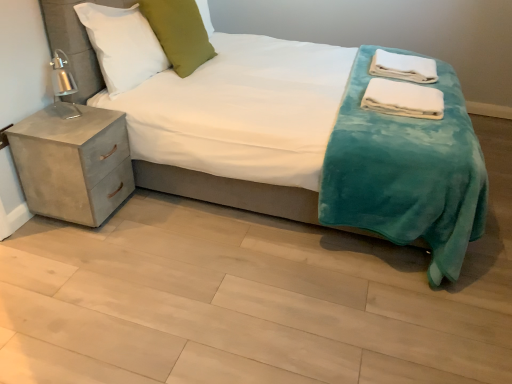
Question: Can you confirm if green velvet pillow at upper center, which appears as the second pillow when viewed from the left, is smaller than concrete nightstand at left?

Choices:
 (A) no
 (B) yes

Answer: (B)

Question: Would you say green velvet pillow at upper center, the first pillow when ordered from right to left, is outside concrete nightstand at left?

Choices:
 (A) yes
 (B) no

Answer: (A)

Question: Is green velvet pillow at upper center, which appears as the second pillow when viewed from the left, in front of concrete nightstand at left?

Choices:
 (A) yes
 (B) no

Answer: (B)

Question: Is green velvet pillow at upper center, the first pillow when ordered from right to left, further to camera compared to concrete nightstand at left?

Choices:
 (A) yes
 (B) no

Answer: (A)

Question: Is green velvet pillow at upper center, which appears as the second pillow when viewed from the left, with concrete nightstand at left?

Choices:
 (A) no
 (B) yes

Answer: (A)

Question: Is green velvet pillow at upper center, the first pillow when ordered from right to left, at the right side of concrete nightstand at left?

Choices:
 (A) yes
 (B) no

Answer: (A)

Question: Is green velvet pillow at upper center, the first pillow when ordered from right to left, closer to camera compared to teal plush blanket at center?

Choices:
 (A) yes
 (B) no

Answer: (B)

Question: Is green velvet pillow at upper center, which appears as the second pillow when viewed from the left, oriented away from teal plush blanket at center?

Choices:
 (A) no
 (B) yes

Answer: (B)

Question: From a real-world perspective, is green velvet pillow at upper center, which appears as the second pillow when viewed from the left, located beneath teal plush blanket at center?

Choices:
 (A) no
 (B) yes

Answer: (A)

Question: Does green velvet pillow at upper center, which appears as the second pillow when viewed from the left, appear on the right side of teal plush blanket at center?

Choices:
 (A) yes
 (B) no

Answer: (B)

Question: Is green velvet pillow at upper center, which appears as the second pillow when viewed from the left, positioned beyond the bounds of teal plush blanket at center?

Choices:
 (A) no
 (B) yes

Answer: (A)

Question: Does green velvet pillow at upper center, which appears as the second pillow when viewed from the left, have a lesser width compared to teal plush blanket at center?

Choices:
 (A) no
 (B) yes

Answer: (B)

Question: Can you confirm if white soft towels at upper right, the second material from the bottom, is positioned to the right of white soft pillow at upper left, the 1th pillow positioned from the left?

Choices:
 (A) no
 (B) yes

Answer: (B)